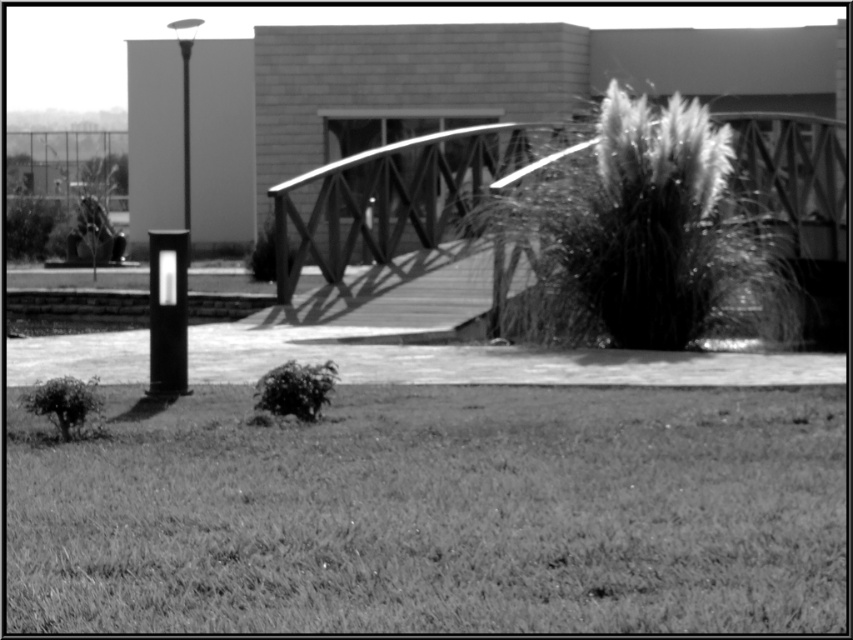
You are a maintenance worker needing to reach the wooden bridge at center from the smooth black post at left. Given that your equipment can only travel 10 meters, will you be able to reach the bridge without moving the equipment?

The distance between the wooden bridge at center and the smooth black post at left is 14.17 meters, which exceeds the equipment travel limit of 10 meters. Therefore, you cannot reach the bridge without moving the equipment.

You are standing at the center of the image. Which direction should you walk to reach the smooth black post at left?

Since the smooth black post at left is located at coordinates approximately 0.489 on the x axis and 0.197 on the y axis, you should walk to the left to reach it.